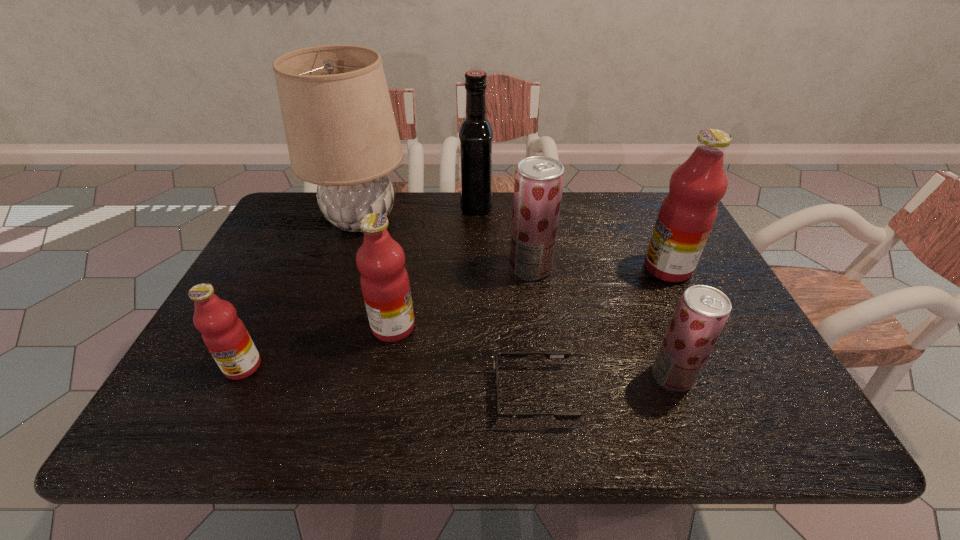
Identify the location of lampshade. The height and width of the screenshot is (540, 960). (x=341, y=133).

The height and width of the screenshot is (540, 960). I want to click on liquor, so click(476, 132).

I want to click on the farthest pink fruit juice, so click(687, 214).

Locate an element on the screen. the rightmost pink fruit juice is located at coordinates (687, 214).

Image resolution: width=960 pixels, height=540 pixels. I want to click on the bigger strawberry fruit juice, so click(x=538, y=187).

Locate an element on the screen. This screenshot has width=960, height=540. the third fruit juice from right to left is located at coordinates (538, 187).

At what (x,y) coordinates should I click in order to perform the action: click on the fifth farthest object. Please return your answer as a coordinate pair (x, y). This screenshot has width=960, height=540. Looking at the image, I should click on (384, 280).

Find the location of `the second fruit juice from left to right`. the second fruit juice from left to right is located at coordinates (384, 280).

At what (x,y) coordinates should I click in order to perform the action: click on the smaller strawberry fruit juice. Please return your answer as a coordinate pair (x, y). This screenshot has height=540, width=960. Looking at the image, I should click on (702, 312).

Where is `the nearer strawberry fruit juice`? the nearer strawberry fruit juice is located at coordinates (702, 312).